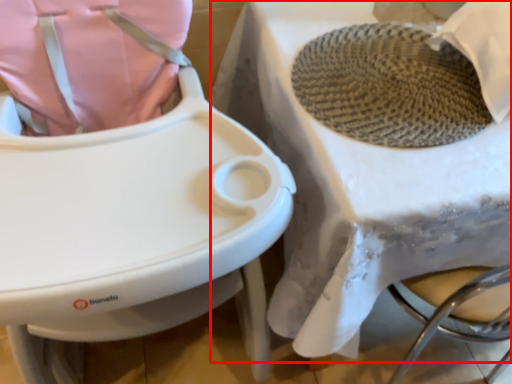
Question: Where is table (annotated by the red box) located in relation to toilet in the image?

Choices:
 (A) left
 (B) right

Answer: (B)